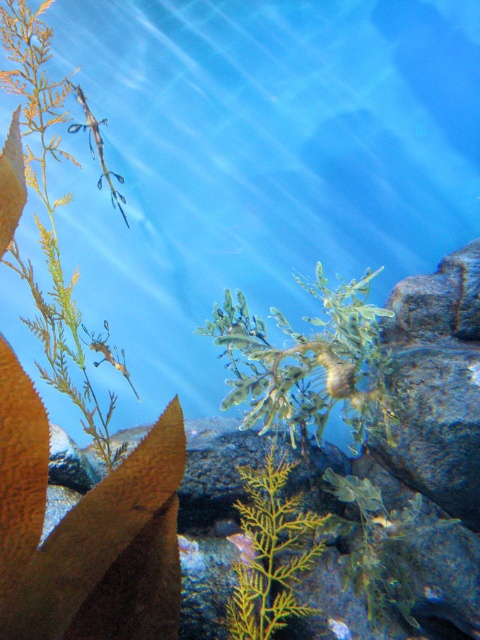
Does green leafy plant at center have a lesser height compared to yellow-green leafy plant at center?

No.

Which of these two, green leafy plant at center or yellow-green leafy plant at center, stands shorter?

yellow-green leafy plant at center

Identify the location of green leafy plant at center. (305, 362).

Find the location of `green leafy plant at center`. green leafy plant at center is located at coordinates [x=305, y=362].

Is green leafy plant at center thinner than translucent glass seahorse at upper left?

Incorrect, green leafy plant at center's width is not less than translucent glass seahorse at upper left's.

Image resolution: width=480 pixels, height=640 pixels. Describe the element at coordinates (305, 362) in the screenshot. I see `green leafy plant at center` at that location.

Does point (349, 282) come farther from viewer compared to point (119, 205)?

Yes, it is behind point (119, 205).

Where is `green leafy plant at center`? This screenshot has width=480, height=640. green leafy plant at center is located at coordinates (305, 362).

Find the location of `yellow-green leafy plant at center`. yellow-green leafy plant at center is located at coordinates (271, 552).

Is point (274, 516) less distant than point (90, 129)?

That is True.

The height and width of the screenshot is (640, 480). Describe the element at coordinates (271, 552) in the screenshot. I see `yellow-green leafy plant at center` at that location.

I want to click on yellow-green leafy plant at center, so click(271, 552).